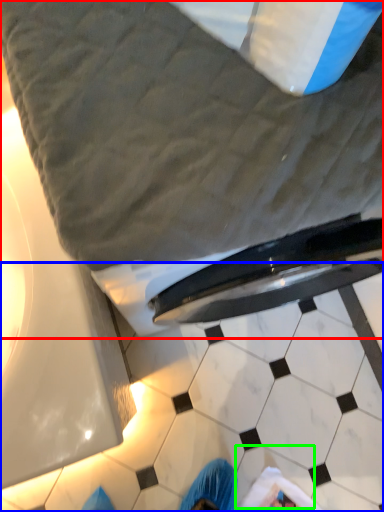
Question: Estimate the real-world distances between objects in this image. Which object is closer to bed (highlighted by a red box), tile (highlighted by a blue box) or tile (highlighted by a green box)?

Choices:
 (A) tile
 (B) tile

Answer: (A)